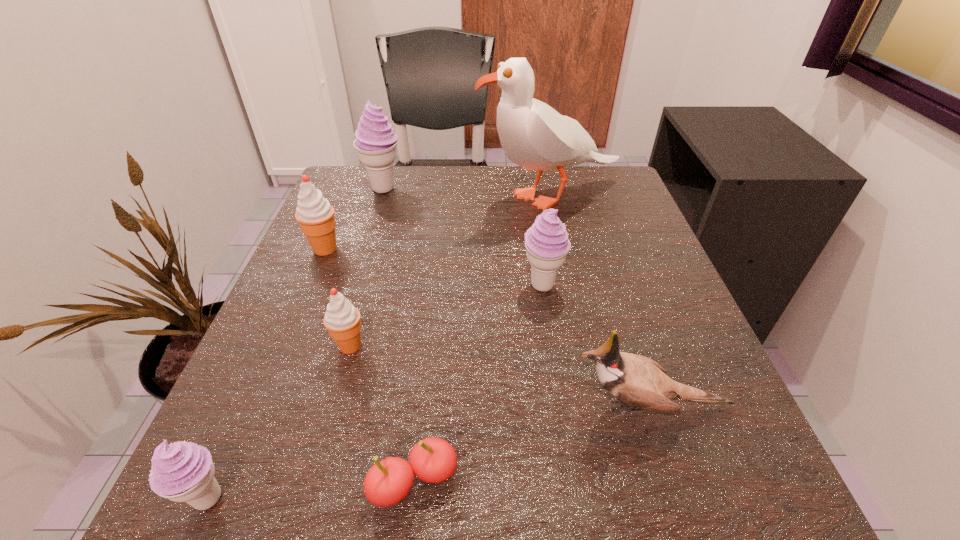
The height and width of the screenshot is (540, 960). What are the coordinates of `the smallest purple icecream` in the screenshot? It's located at (182, 471).

The image size is (960, 540). In order to click on the nearest purple icecream in this screenshot , I will do `click(182, 471)`.

I want to click on cherry, so click(433, 460).

You are a GUI agent. You are given a task and a screenshot of the screen. Output one action in this format:
    pyautogui.click(x=<x>, y=<y>)
    Task: Click on the shortest object
    Image resolution: width=960 pixels, height=540 pixels.
    Given the screenshot: What is the action you would take?
    pyautogui.click(x=433, y=460)

Image resolution: width=960 pixels, height=540 pixels. Identify the location of free location located 0.350m at the beak of the gull. (328, 197).

The height and width of the screenshot is (540, 960). Find the location of `vacant area situated at the beak of the gull`. vacant area situated at the beak of the gull is located at coordinates (371, 197).

Find the location of a particular element. This screenshot has height=540, width=960. vacant space located at the beak of the gull is located at coordinates (443, 197).

Where is `free location located on the left of the seventh shortest object`? Image resolution: width=960 pixels, height=540 pixels. free location located on the left of the seventh shortest object is located at coordinates (338, 188).

Where is `vacant space located on the front of the second farthest icecream`? vacant space located on the front of the second farthest icecream is located at coordinates (250, 428).

This screenshot has height=540, width=960. I want to click on vacant area situated on the right of the third farthest icecream, so click(650, 286).